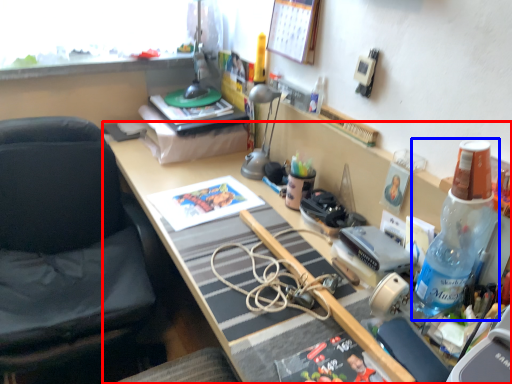
Question: Which object is further to the camera taking this photo, desk (highlighted by a red box) or bottle (highlighted by a blue box)?

Choices:
 (A) desk
 (B) bottle

Answer: (B)